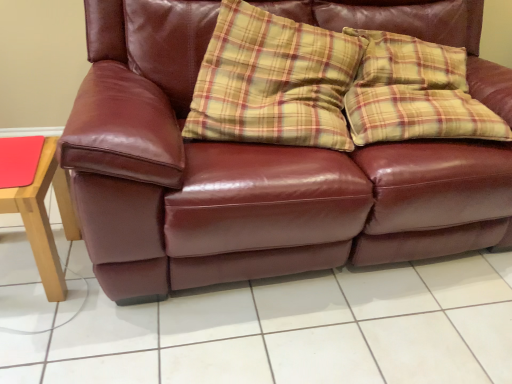
Question: Considering the positions of point (59, 182) and point (195, 321), is point (59, 182) closer or farther from the camera than point (195, 321)?

Choices:
 (A) closer
 (B) farther

Answer: (B)

Question: Is matte wood table at left bigger or smaller than matte leather couch at center?

Choices:
 (A) small
 (B) big

Answer: (A)

Question: Estimate the real-world distances between objects in this image. Which object is closer to the matte wood table at left?

Choices:
 (A) matte leather couch at center
 (B) burgundy leather couch at center

Answer: (A)

Question: Estimate the real-world distances between objects in this image. Which object is closer to the matte leather couch at center?

Choices:
 (A) matte wood table at left
 (B) burgundy leather couch at center

Answer: (B)